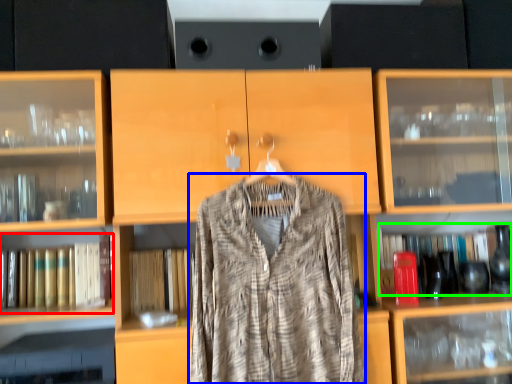
Question: Which is farther away from book (highlighted by a red box)? fancy dress (highlighted by a blue box) or book (highlighted by a green box)?

Choices:
 (A) fancy dress
 (B) book

Answer: (B)